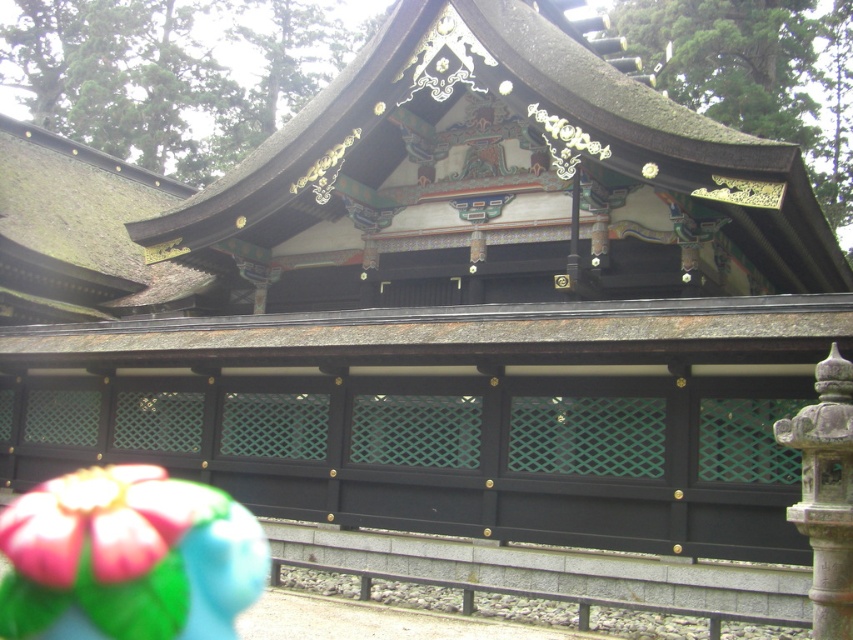
Question: Does shiny dark brown roof at center appear on the left side of dark gray stone pillar at right?

Choices:
 (A) no
 (B) yes

Answer: (B)

Question: Can you confirm if shiny dark brown roof at center is wider than green mossy thatch at upper left?

Choices:
 (A) yes
 (B) no

Answer: (A)

Question: Does shiny dark brown roof at center have a lesser width compared to green mossy thatch at upper left?

Choices:
 (A) no
 (B) yes

Answer: (A)

Question: Which object appears farthest from the camera in this image?

Choices:
 (A) shiny dark brown roof at center
 (B) green mossy thatch at upper left
 (C) dark gray stone pillar at right

Answer: (B)

Question: Which of these objects is positioned closest to the shiny dark brown roof at center?

Choices:
 (A) dark gray stone pillar at right
 (B) green mossy thatch at upper left

Answer: (B)

Question: Among these objects, which one is nearest to the camera?

Choices:
 (A) green mossy thatch at upper left
 (B) shiny dark brown roof at center
 (C) dark gray stone pillar at right

Answer: (C)